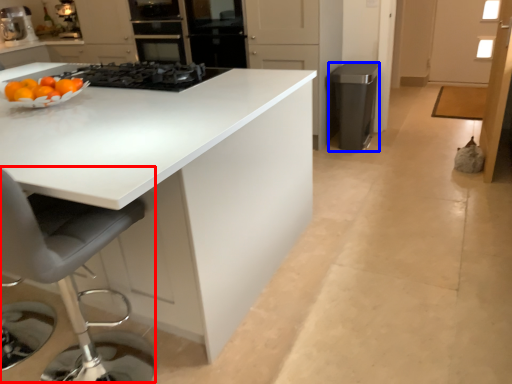
Question: Which point is further to the camera, swivel chair (highlighted by a red box) or appliance (highlighted by a blue box)?

Choices:
 (A) swivel chair
 (B) appliance

Answer: (B)